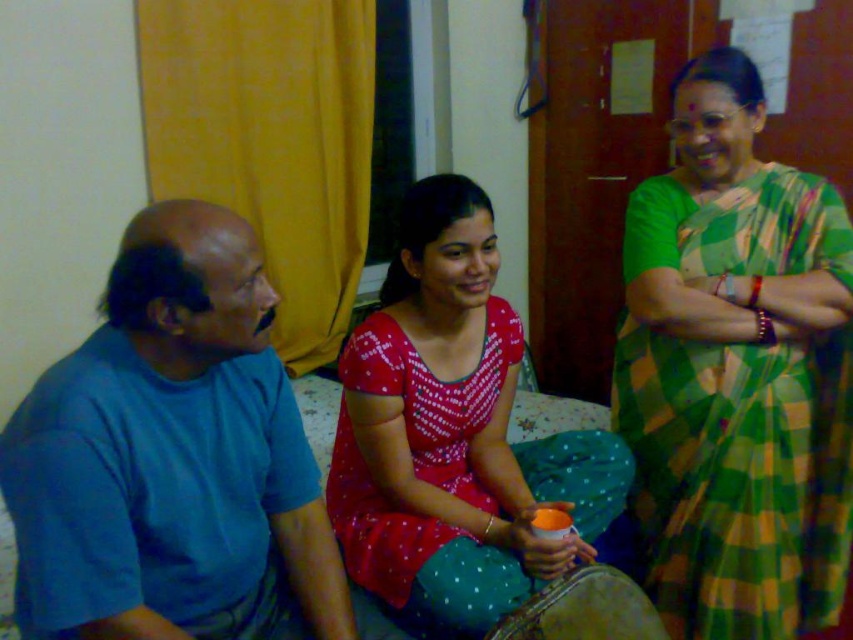
Question: Is blue cotton shirt at left thinner than matte red blouse at center?

Choices:
 (A) yes
 (B) no

Answer: (A)

Question: Does blue cotton shirt at left lie in front of matte red blouse at center?

Choices:
 (A) no
 (B) yes

Answer: (B)

Question: Which point is farther to the camera?

Choices:
 (A) (792, 276)
 (B) (83, 634)
 (C) (500, 618)

Answer: (A)

Question: Is blue cotton shirt at left thinner than matte red blouse at center?

Choices:
 (A) yes
 (B) no

Answer: (A)

Question: Among these objects, which one is nearest to the camera?

Choices:
 (A) blue cotton shirt at left
 (B) green checkered saree at right

Answer: (A)

Question: Among these points, which one is farthest from the camera?

Choices:
 (A) (189, 312)
 (B) (824, 372)
 (C) (439, 273)

Answer: (B)